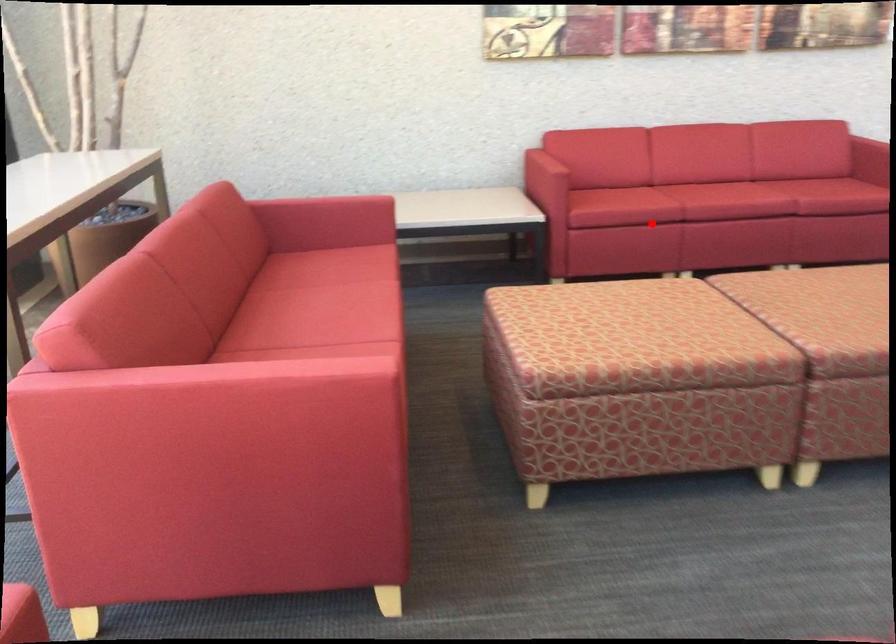
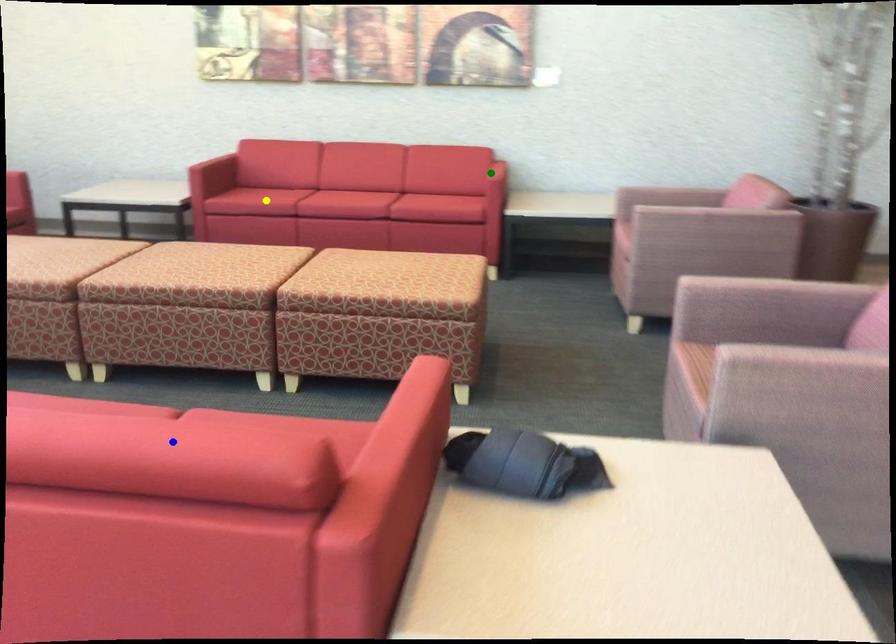
Question: I am providing you with two images of the same scene from different viewpoints. A red point is marked on the first image. You are given multiple points on the second image. In image 2, which mark is for the same physical point as the one in image 1?

Choices:
 (A) yellow point
 (B) blue point
 (C) green point

Answer: (A)